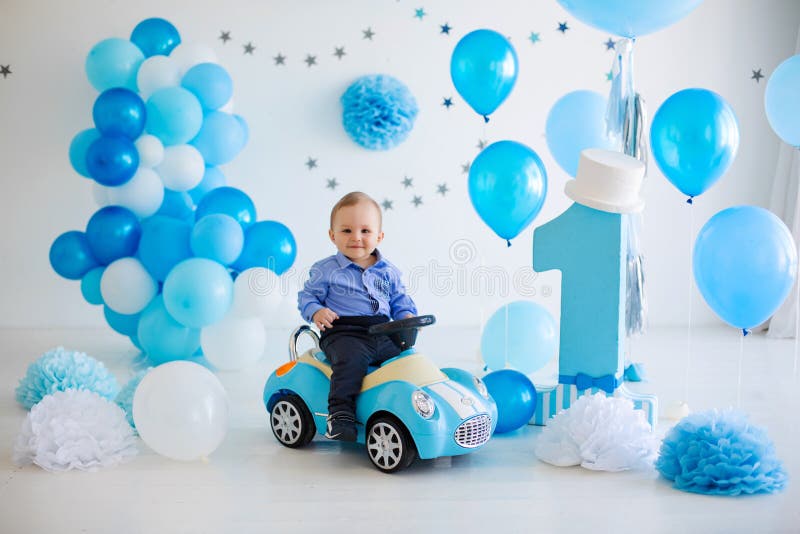
The width and height of the screenshot is (800, 534). Identify the location of paper flower. (726, 455), (612, 437), (86, 367), (82, 431), (393, 107).